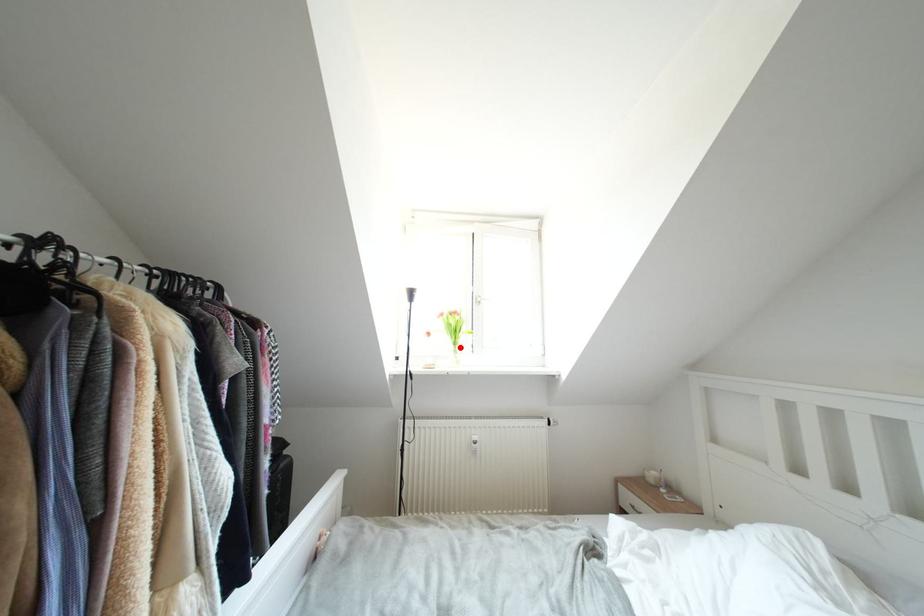
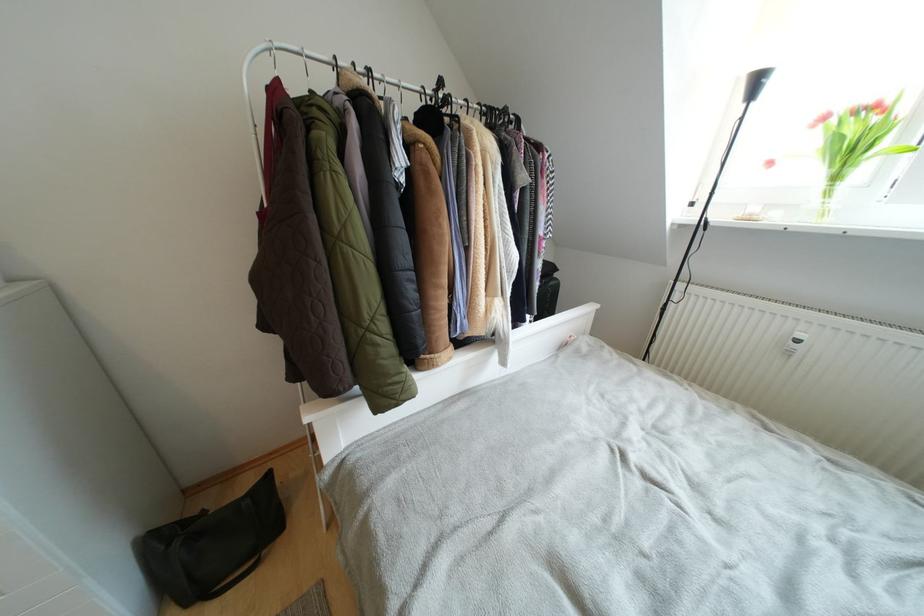
Where in the second image is the point corresponding to the highlighted location from the first image?

(840, 182)